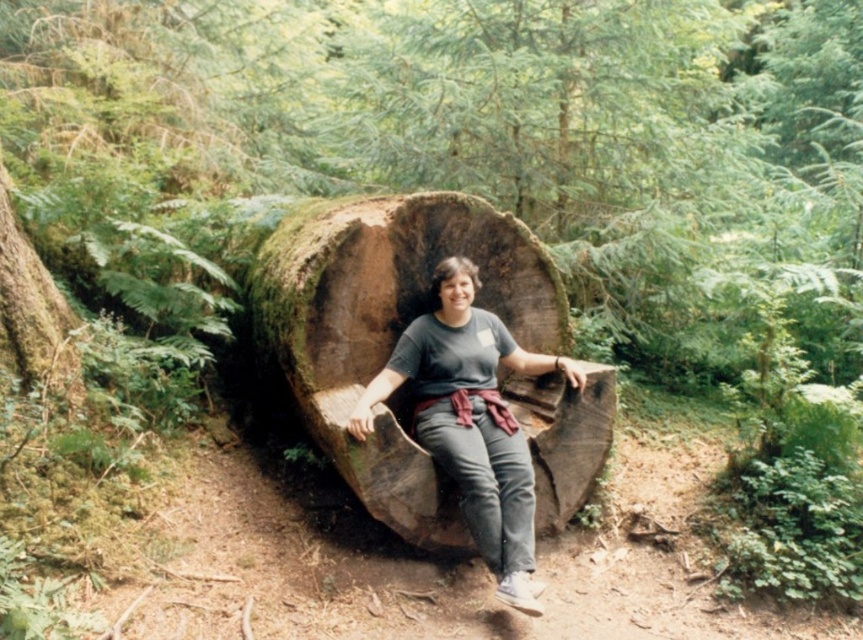
You are a hiker who has found a cozy spot in the forest. You see a matte gray shirt at center and a green mossy log at left. Which object is positioned lower in the scene?

The matte gray shirt at center is below the green mossy log at left, so the matte gray shirt at center is positioned lower in the scene.

You are a photographer aiming to capture the matte gray shirt at center and the green mossy log at left in a single frame. Based on their positions, which object will appear larger in the photo?

The matte gray shirt at center appears larger in the photo because it is closer to the viewer than the green mossy log at left.